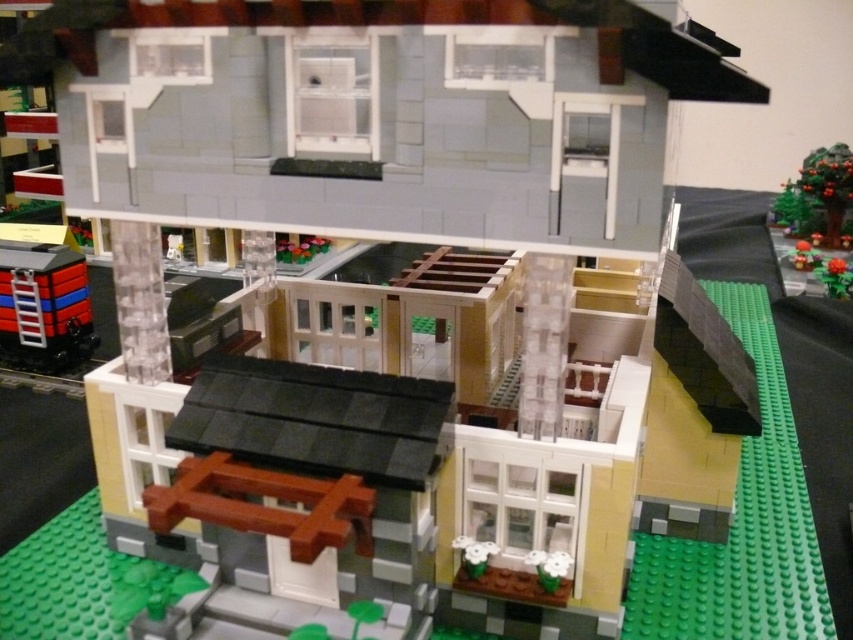
Question: Is matte black train at left wider than green matte tree at upper right?

Choices:
 (A) no
 (B) yes

Answer: (B)

Question: Is matte black train at left wider than green matte tree at upper right?

Choices:
 (A) no
 (B) yes

Answer: (B)

Question: Which point appears farthest from the camera in this image?

Choices:
 (A) (68, 289)
 (B) (827, 225)

Answer: (B)

Question: Among these points, which one is farthest from the camera?

Choices:
 (A) (9, 248)
 (B) (815, 196)

Answer: (B)

Question: Can you confirm if matte black train at left is positioned to the left of green matte tree at upper right?

Choices:
 (A) no
 (B) yes

Answer: (B)